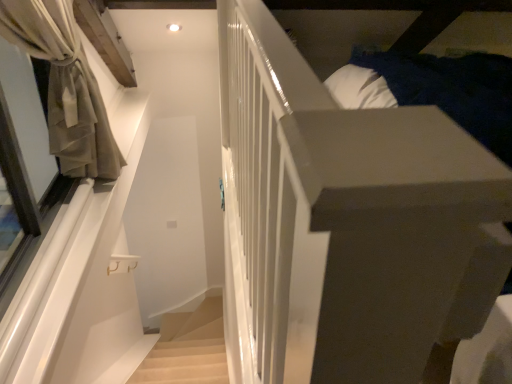
Question: Is point pyautogui.click(x=109, y=173) positioned closer to the camera than point pyautogui.click(x=176, y=349)?

Choices:
 (A) farther
 (B) closer

Answer: (B)

Question: In terms of width, does beige sheer curtain at left look wider or thinner when compared to light beige carpeted stairs at lower center?

Choices:
 (A) thin
 (B) wide

Answer: (B)

Question: Based on their positions, is beige sheer curtain at left located to the left or right of light beige carpeted stairs at lower center?

Choices:
 (A) right
 (B) left

Answer: (B)

Question: From a real-world perspective, is light beige carpeted stairs at lower center physically located above or below beige sheer curtain at left?

Choices:
 (A) above
 (B) below

Answer: (B)

Question: Which is correct: light beige carpeted stairs at lower center is inside beige sheer curtain at left, or outside of it?

Choices:
 (A) outside
 (B) inside

Answer: (A)

Question: Looking at their shapes, would you say light beige carpeted stairs at lower center is wider or thinner than beige sheer curtain at left?

Choices:
 (A) wide
 (B) thin

Answer: (B)

Question: From their relative heights in the image, would you say light beige carpeted stairs at lower center is taller or shorter than beige sheer curtain at left?

Choices:
 (A) tall
 (B) short

Answer: (B)